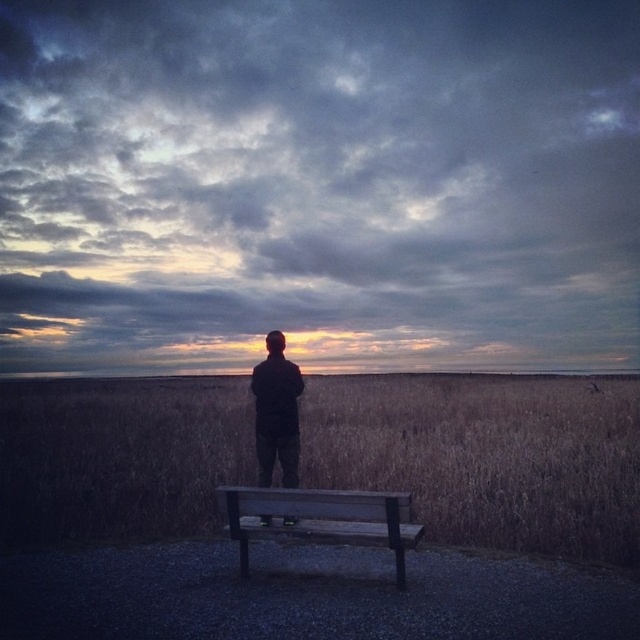
You are standing at the edge of the gravel path where the wooden bench is located. Looking towards the horizon, you notice a specific point marked at coordinates (486, 456). What does this point represent in the scene?

The point at coordinates (486, 456) represents the brown grassy field at center.

You are standing on the gravel path and want to place a 1.5 meter long wooden bench between the brown grassy field at center and the black matte jacket at center. Is there enough space to place the bench without overlapping either object?

The distance between the brown grassy field at center and the black matte jacket at center is 7.62 meters. Since the bench is only 1.5 meters long, there is sufficient space to place it between them without overlapping either object.

You are standing at the center of the gravel path and want to sit on the wooden bench at lower center. In which direction should you walk to reach it?

Since the wooden bench at lower center is located at point 0.812 on the x axis and 0.502 on the y axis, you should walk towards the right direction to reach it.